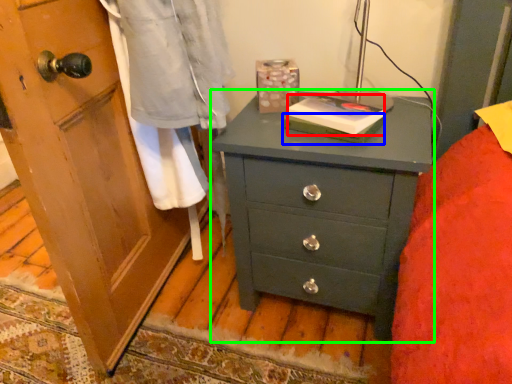
Question: Based on their relative distances, which object is farther from book (highlighted by a red box)? Choose from book (highlighted by a blue box) and chest of drawers (highlighted by a green box).

Choices:
 (A) book
 (B) chest of drawers

Answer: (B)